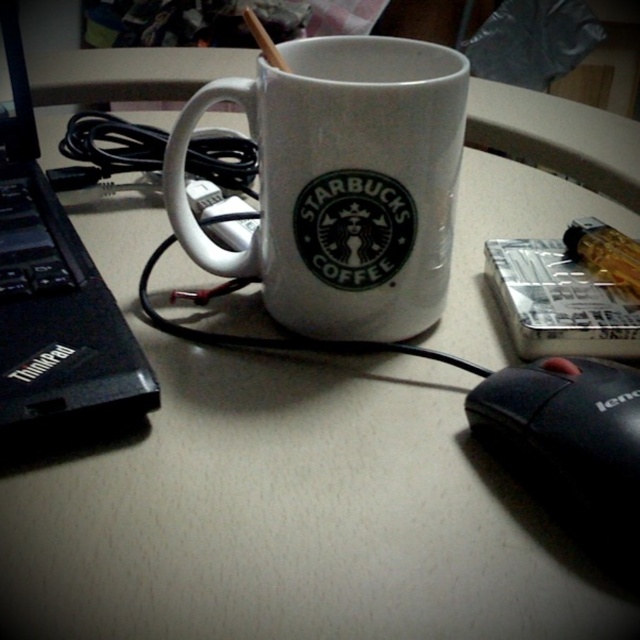
You are organizing your desk and want to place the white ceramic mug at center and the black plastic thinkpad at left into a drawer. The drawer has a height limit of 10 cm. Can both items fit vertically if placed upright?

The white ceramic mug at center has a smaller size compared to black plastic thinkpad at left. However, the height of each item is not specified in the description. Therefore, it is uncertain if both items can fit vertically in the drawer with a 10 cm height limit.

You are organizing your desk and want to move the black matte mouse at lower right to a new location. However, you need to ensure that it won not be obstructed by the white ceramic mug at center. Can you move it directly to the right of the mug?

The white ceramic mug at center is positioned over the black matte mouse at lower right. Therefore, moving the black matte mouse at lower right directly to the right of the mug would not be obstructed by the mug itself, but since the mouse is currently under the mug, you would need to first remove it from under the mug before moving it.